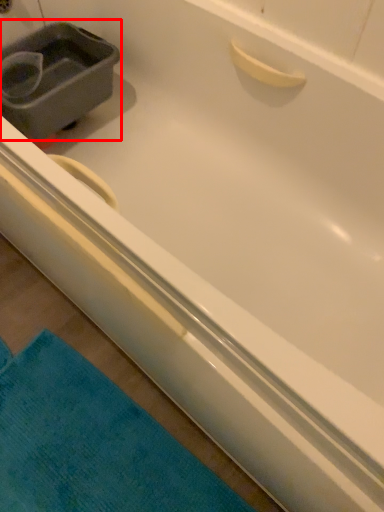
Question: Observing the image, what is the correct spatial positioning of sink (annotated by the red box) in reference to bath towel?

Choices:
 (A) left
 (B) right

Answer: (A)